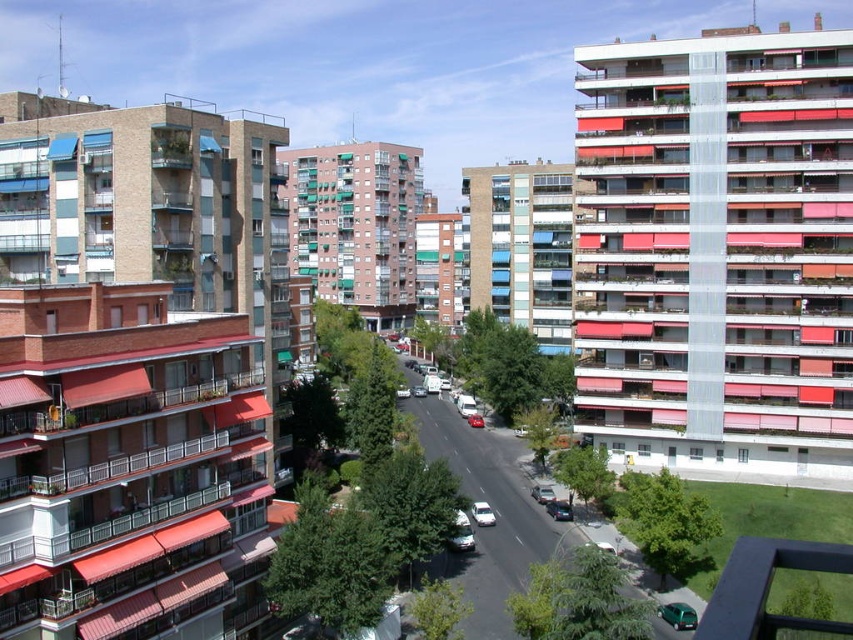
Question: Which point is closer to the camera?

Choices:
 (A) white matte car at center
 (B) metallic silver van at center

Answer: (A)

Question: Does metallic silver balcony at upper right have a larger size compared to metallic green car at center?

Choices:
 (A) no
 (B) yes

Answer: (B)

Question: Where is metallic green car at center located in relation to metallic silver car at center in the image?

Choices:
 (A) right
 (B) left

Answer: (A)

Question: Which object appears closest to the camera in this image?

Choices:
 (A) metallic silver car at center
 (B) white matte car at center
 (C) shiny red car at center
 (D) metallic green car at center

Answer: (D)

Question: Which point is farther to the camera?

Choices:
 (A) metallic green car at center
 (B) shiny red car at center

Answer: (B)

Question: Is metallic green car at center wider than shiny red car at center?

Choices:
 (A) no
 (B) yes

Answer: (A)